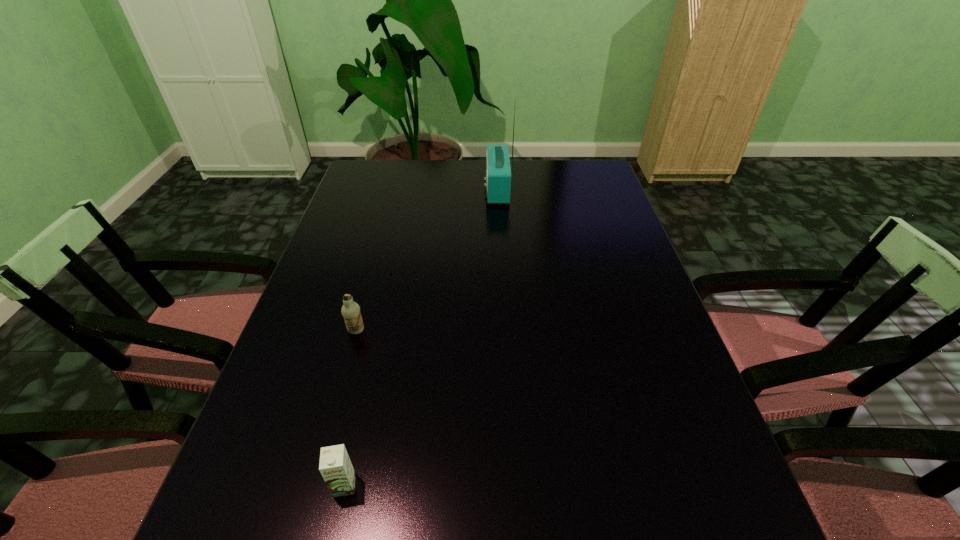
What are the coordinates of `free location located 0.330m on the right of the right chocolate milk` in the screenshot? It's located at (546, 485).

Identify the location of object located at the far edge. The width and height of the screenshot is (960, 540). coord(498,171).

Locate an element on the screen. This screenshot has height=540, width=960. object located in the left edge section of the desktop is located at coordinates (350, 310).

In the image, there is a desktop. At what (x,y) coordinates should I click in order to perform the action: click on vacant space at the far edge. Please return your answer as a coordinate pair (x, y). The image size is (960, 540). Looking at the image, I should click on (556, 177).

Image resolution: width=960 pixels, height=540 pixels. What are the coordinates of `blank space at the near edge of the desktop` in the screenshot? It's located at [x=458, y=537].

You are a GUI agent. You are given a task and a screenshot of the screen. Output one action in this format:
    pyautogui.click(x=<x>, y=<y>)
    Task: Click on the vacant region at the left edge of the desktop
    The height and width of the screenshot is (540, 960).
    Given the screenshot: What is the action you would take?
    pyautogui.click(x=268, y=416)

What are the coordinates of `vacant space at the right edge of the desktop` in the screenshot? It's located at pyautogui.click(x=634, y=244).

This screenshot has width=960, height=540. I want to click on free space between the left chocolate milk and the nearest object, so click(350, 408).

What are the coordinates of `free space between the left chocolate milk and the second object from right to left` in the screenshot? It's located at (350, 408).

Find the location of `free space that is in between the farther chocolate milk and the rightmost object`. free space that is in between the farther chocolate milk and the rightmost object is located at coordinates (427, 260).